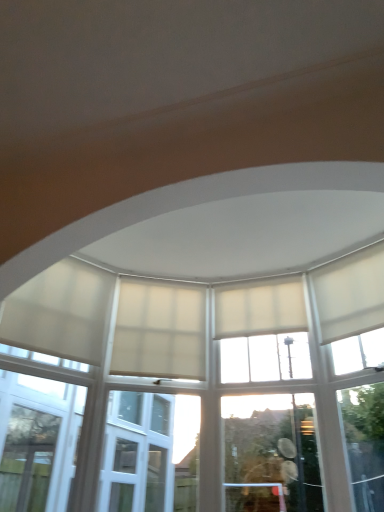
This screenshot has width=384, height=512. What do you see at coordinates (160, 331) in the screenshot?
I see `beige fabric curtain at center, the 3th curtain when ordered from right to left` at bounding box center [160, 331].

Where is `white matte curtain at left, the fourth curtain positioned from the right`? This screenshot has width=384, height=512. white matte curtain at left, the fourth curtain positioned from the right is located at coordinates (60, 312).

At what (x,y) coordinates should I click in order to perform the action: click on the 2nd curtain located beneath the white matte curtain at upper right, which appears as the 4th curtain when viewed from the left (from a real-world perspective). Please return your answer as a coordinate pair (x, y). The height and width of the screenshot is (512, 384). Looking at the image, I should click on (160, 331).

Is white matte curtain at upper right, which appears as the 4th curtain when viewed from the left, closer to camera compared to beige fabric curtain at center, the 3th curtain when ordered from right to left?

Yes, the depth of white matte curtain at upper right, which appears as the 4th curtain when viewed from the left, is less than that of beige fabric curtain at center, the 3th curtain when ordered from right to left.

Is beige fabric curtain at center, the 3th curtain when ordered from right to left, completely or partially inside white matte curtain at upper right, placed as the 1th curtain when sorted from right to left?

No, beige fabric curtain at center, the 3th curtain when ordered from right to left, is not surrounded by white matte curtain at upper right, placed as the 1th curtain when sorted from right to left.

Does white matte curtain at upper right, which appears as the 4th curtain when viewed from the left, have a larger size compared to beige fabric curtain at center, the second curtain viewed from the left?

Correct, white matte curtain at upper right, which appears as the 4th curtain when viewed from the left, is larger in size than beige fabric curtain at center, the second curtain viewed from the left.

Which of these two, white matte curtain at center, which ranks as the third curtain in left-to-right order, or beige fabric curtain at center, the second curtain viewed from the left, is wider?

Wider between the two is white matte curtain at center, which ranks as the third curtain in left-to-right order.

Does point (289, 292) come behind point (148, 362)?

That is True.

Consider the image. From a real-world perspective, who is located lower, white matte curtain at center, which is the second curtain from right to left, or beige fabric curtain at center, the second curtain viewed from the left?

beige fabric curtain at center, the second curtain viewed from the left.

From the image's perspective, is white matte curtain at center, which ranks as the third curtain in left-to-right order, located above or below beige fabric curtain at center, the second curtain viewed from the left?

white matte curtain at center, which ranks as the third curtain in left-to-right order, is situated higher than beige fabric curtain at center, the second curtain viewed from the left, in the image.

Which of these two, beige fabric curtain at center, the second curtain viewed from the left, or white matte curtain at left, the fourth curtain positioned from the right, is thinner?

With smaller width is beige fabric curtain at center, the second curtain viewed from the left.

Is beige fabric curtain at center, the second curtain viewed from the left, to the left of white matte curtain at left, the fourth curtain positioned from the right, from the viewer's perspective?

No, beige fabric curtain at center, the second curtain viewed from the left, is not to the left of white matte curtain at left, the fourth curtain positioned from the right.

Considering the positions of points (201, 287) and (72, 356), is point (201, 287) farther from camera compared to point (72, 356)?

Yes, point (201, 287) is behind point (72, 356).

Measure the distance from beige fabric curtain at center, the 3th curtain when ordered from right to left, to white matte curtain at left, the fourth curtain positioned from the right.

A distance of 42.52 centimeters exists between beige fabric curtain at center, the 3th curtain when ordered from right to left, and white matte curtain at left, the fourth curtain positioned from the right.

From the image's perspective, between white matte curtain at left, the fourth curtain positioned from the right, and white matte curtain at upper right, which appears as the 4th curtain when viewed from the left, which one is located above?

white matte curtain at upper right, which appears as the 4th curtain when viewed from the left, from the image's perspective.

How far apart are white matte curtain at left, the first curtain viewed from the left, and white matte curtain at upper right, placed as the 1th curtain when sorted from right to left?

They are 1.77 meters apart.

Is point (45, 324) in front of point (356, 293)?

Yes, point (45, 324) is closer to viewer.

Considering the sizes of objects white matte curtain at left, the first curtain viewed from the left, and white matte curtain at upper right, placed as the 1th curtain when sorted from right to left, in the image provided, who is taller, white matte curtain at left, the first curtain viewed from the left, or white matte curtain at upper right, placed as the 1th curtain when sorted from right to left,?

With more height is white matte curtain at left, the first curtain viewed from the left.

Considering the relative positions of white matte curtain at left, the first curtain viewed from the left, and beige fabric curtain at center, the second curtain viewed from the left, in the image provided, is white matte curtain at left, the first curtain viewed from the left, to the right of beige fabric curtain at center, the second curtain viewed from the left, from the viewer's perspective?

In fact, white matte curtain at left, the first curtain viewed from the left, is to the left of beige fabric curtain at center, the second curtain viewed from the left.

Does point (45, 335) appear closer or farther from the camera than point (126, 372)?

Point (45, 335) appears to be closer to the viewer than point (126, 372).

From a real-world perspective, is white matte curtain at left, the fourth curtain positioned from the right, above or below beige fabric curtain at center, the second curtain viewed from the left?

From a real-world perspective, white matte curtain at left, the fourth curtain positioned from the right, is physically above beige fabric curtain at center, the second curtain viewed from the left.

Is white matte curtain at left, the fourth curtain positioned from the right, aimed at beige fabric curtain at center, the second curtain viewed from the left?

No, white matte curtain at left, the fourth curtain positioned from the right, is not oriented towards beige fabric curtain at center, the second curtain viewed from the left.

From a real-world perspective, which object stands above the other?

white matte curtain at center, which ranks as the third curtain in left-to-right order, is physically above.

Between white matte curtain at left, the first curtain viewed from the left, and white matte curtain at center, which is the second curtain from right to left, which one appears on the left side from the viewer's perspective?

Positioned to the left is white matte curtain at left, the first curtain viewed from the left.

Is white matte curtain at left, the first curtain viewed from the left, facing towards white matte curtain at center, which ranks as the third curtain in left-to-right order?

No, white matte curtain at left, the first curtain viewed from the left, is not aimed at white matte curtain at center, which ranks as the third curtain in left-to-right order.

You are a GUI agent. You are given a task and a screenshot of the screen. Output one action in this format:
    pyautogui.click(x=<x>, y=<y>)
    Task: Click on the curtain above the white matte curtain at upper right, which appears as the 4th curtain when viewed from the left (from a real-world perspective)
    The image size is (384, 512).
    Given the screenshot: What is the action you would take?
    pyautogui.click(x=260, y=308)

Is point (345, 273) positioned behind point (239, 316)?

No, it is in front of (239, 316).

Is white matte curtain at upper right, which appears as the 4th curtain when viewed from the left, oriented away from white matte curtain at center, which is the second curtain from right to left?

No, white matte curtain at upper right, which appears as the 4th curtain when viewed from the left, is not facing the opposite direction of white matte curtain at center, which is the second curtain from right to left.

From the image's perspective, which curtain is the 3rd one below the white matte curtain at upper right, placed as the 1th curtain when sorted from right to left? Please provide its 2D coordinates.

[(160, 331)]

The height and width of the screenshot is (512, 384). I want to click on curtain behind the beige fabric curtain at center, the 3th curtain when ordered from right to left, so click(260, 308).

Considering their positions, is white matte curtain at center, which ranks as the third curtain in left-to-right order, positioned closer to white matte curtain at upper right, which appears as the 4th curtain when viewed from the left, than beige fabric curtain at center, the 3th curtain when ordered from right to left?

white matte curtain at center, which ranks as the third curtain in left-to-right order, is positioned closer to the anchor white matte curtain at upper right, which appears as the 4th curtain when viewed from the left.

Estimate the real-world distances between objects in this image. Which object is closer to white matte curtain at center, which ranks as the third curtain in left-to-right order, beige fabric curtain at center, the 3th curtain when ordered from right to left, or white matte curtain at left, the fourth curtain positioned from the right?

beige fabric curtain at center, the 3th curtain when ordered from right to left, lies closer to white matte curtain at center, which ranks as the third curtain in left-to-right order, than the other object.

Considering their positions, is beige fabric curtain at center, the 3th curtain when ordered from right to left, positioned further to white matte curtain at upper right, which appears as the 4th curtain when viewed from the left, than white matte curtain at left, the first curtain viewed from the left?

Among the two, white matte curtain at left, the first curtain viewed from the left, is located further to white matte curtain at upper right, which appears as the 4th curtain when viewed from the left.

Considering their positions, is white matte curtain at upper right, placed as the 1th curtain when sorted from right to left, positioned closer to beige fabric curtain at center, the 3th curtain when ordered from right to left, than white matte curtain at left, the first curtain viewed from the left?

white matte curtain at left, the first curtain viewed from the left, is positioned closer to the anchor beige fabric curtain at center, the 3th curtain when ordered from right to left.

Considering their positions, is white matte curtain at left, the first curtain viewed from the left, positioned closer to white matte curtain at center, which ranks as the third curtain in left-to-right order, than white matte curtain at upper right, which appears as the 4th curtain when viewed from the left?

white matte curtain at upper right, which appears as the 4th curtain when viewed from the left.

From the picture: Based on their spatial positions, is white matte curtain at center, which is the second curtain from right to left, or white matte curtain at left, the first curtain viewed from the left, further from beige fabric curtain at center, the second curtain viewed from the left?

The object further to beige fabric curtain at center, the second curtain viewed from the left, is white matte curtain at center, which is the second curtain from right to left.

Considering their positions, is white matte curtain at left, the fourth curtain positioned from the right, positioned further to white matte curtain at center, which is the second curtain from right to left, than beige fabric curtain at center, the 3th curtain when ordered from right to left?

The object further to white matte curtain at center, which is the second curtain from right to left, is white matte curtain at left, the fourth curtain positioned from the right.

Consider the image. Which object lies further to the anchor point white matte curtain at upper right, which appears as the 4th curtain when viewed from the left, white matte curtain at left, the first curtain viewed from the left, or beige fabric curtain at center, the 3th curtain when ordered from right to left?

white matte curtain at left, the first curtain viewed from the left, is further to white matte curtain at upper right, which appears as the 4th curtain when viewed from the left.

Where is `curtain between beige fabric curtain at center, the second curtain viewed from the left, and white matte curtain at upper right, which appears as the 4th curtain when viewed from the left, from left to right`? curtain between beige fabric curtain at center, the second curtain viewed from the left, and white matte curtain at upper right, which appears as the 4th curtain when viewed from the left, from left to right is located at coordinates (260, 308).

You are a GUI agent. You are given a task and a screenshot of the screen. Output one action in this format:
    pyautogui.click(x=<x>, y=<y>)
    Task: Click on the curtain between white matte curtain at left, the first curtain viewed from the left, and white matte curtain at center, which ranks as the third curtain in left-to-right order, in the horizontal direction
    This screenshot has height=512, width=384.
    Given the screenshot: What is the action you would take?
    pyautogui.click(x=160, y=331)